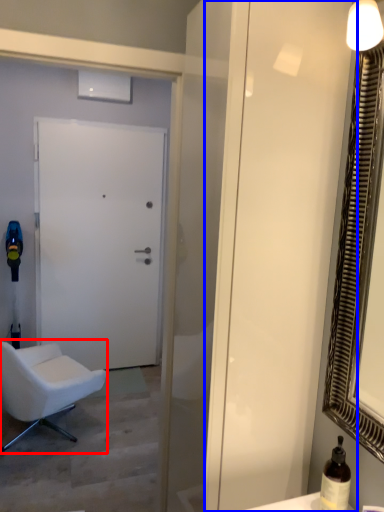
Question: Among these objects, which one is nearest to the camera, chair (highlighted by a red box) or screen door (highlighted by a blue box)?

Choices:
 (A) chair
 (B) screen door

Answer: (B)